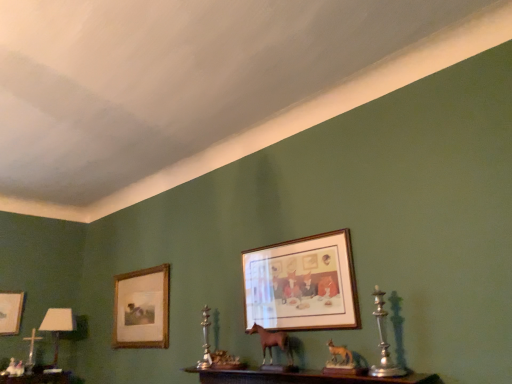
Question: From the image's perspective, would you say white glossy table lamp at lower left is shown under wooden picture frame at left, which ranks as the 2th picture frame in right-to-left order?

Choices:
 (A) yes
 (B) no

Answer: (A)

Question: Are white glossy table lamp at lower left and wooden picture frame at left, which ranks as the 2th picture frame in front-to-back order, far apart?

Choices:
 (A) no
 (B) yes

Answer: (A)

Question: Is white glossy table lamp at lower left positioned with its back to wooden picture frame at left, which ranks as the second picture frame in left-to-right order?

Choices:
 (A) no
 (B) yes

Answer: (A)

Question: Does white glossy table lamp at lower left come behind wooden picture frame at left, which ranks as the 2th picture frame in right-to-left order?

Choices:
 (A) no
 (B) yes

Answer: (B)

Question: Can you see white glossy table lamp at lower left touching wooden picture frame at left, which ranks as the 2th picture frame in front-to-back order?

Choices:
 (A) yes
 (B) no

Answer: (B)

Question: Does point (377, 322) appear closer or farther from the camera than point (250, 334)?

Choices:
 (A) closer
 (B) farther

Answer: (A)

Question: From the image's perspective, is silver metallic candle holder at right, the 1th candle holder from the right, above or below brown matte horse at center?

Choices:
 (A) above
 (B) below

Answer: (A)

Question: Considering the relative positions of silver metallic candle holder at right, which is counted as the second candle holder, starting from the back, and brown matte horse at center in the image provided, is silver metallic candle holder at right, which is counted as the second candle holder, starting from the back, to the left or to the right of brown matte horse at center?

Choices:
 (A) right
 (B) left

Answer: (A)

Question: Relative to brown matte horse at center, is silver metallic candle holder at right, the 2th candle holder in the bottom-to-top sequence, in front or behind?

Choices:
 (A) behind
 (B) front

Answer: (B)

Question: Is silver metallic candle holder at center, which ranks as the first candle holder in left-to-right order, inside the boundaries of white glossy table lamp at lower left, or outside?

Choices:
 (A) outside
 (B) inside

Answer: (A)

Question: Looking at the image, does silver metallic candle holder at center, the second candle holder from the front, seem bigger or smaller compared to white glossy table lamp at lower left?

Choices:
 (A) big
 (B) small

Answer: (B)

Question: Is silver metallic candle holder at center, marked as the second candle holder in a right-to-left arrangement, taller or shorter than white glossy table lamp at lower left?

Choices:
 (A) tall
 (B) short

Answer: (B)

Question: From a real-world perspective, relative to white glossy table lamp at lower left, is silver metallic candle holder at center, marked as the second candle holder in a right-to-left arrangement, vertically above or below?

Choices:
 (A) below
 (B) above

Answer: (A)

Question: Considering the positions of white glossy table lamp at lower left and matte gold picture frame at left, positioned as the third picture frame in front-to-back order, in the image, is white glossy table lamp at lower left wider or thinner than matte gold picture frame at left, positioned as the third picture frame in front-to-back order,?

Choices:
 (A) wide
 (B) thin

Answer: (A)

Question: Is white glossy table lamp at lower left spatially inside matte gold picture frame at left, positioned as the third picture frame in front-to-back order, or outside of it?

Choices:
 (A) inside
 (B) outside

Answer: (B)